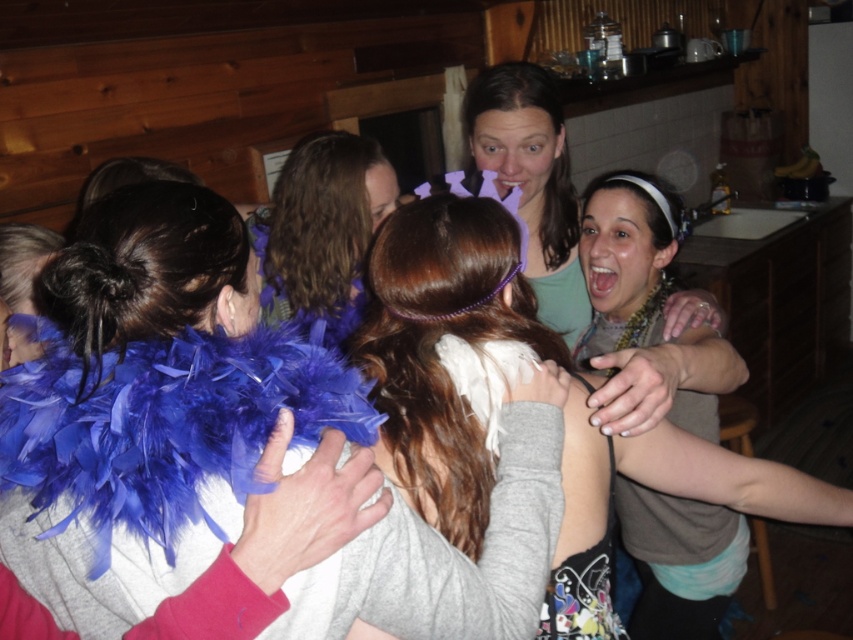
Is matte black tank top at center above matte purple headband at upper center?

Actually, matte black tank top at center is below matte purple headband at upper center.

Identify the location of matte black tank top at center. (643, 292).

Between point (706, 374) and point (630, 381), which one is positioned in front?

Point (630, 381)

Locate an element on the screen. matte black tank top at center is located at coordinates (643, 292).

Is white feather boa at center shorter than matte black tank top at center?

Yes, white feather boa at center is shorter than matte black tank top at center.

Locate an element on the screen. white feather boa at center is located at coordinates (440, 348).

Locate an element on the screen. The height and width of the screenshot is (640, 853). white feather boa at center is located at coordinates (440, 348).

Does blue feather boa at center appear on the right side of matte black tank top at center?

Incorrect, blue feather boa at center is not on the right side of matte black tank top at center.

Can you confirm if blue feather boa at center is bigger than matte black tank top at center?

Actually, blue feather boa at center might be smaller than matte black tank top at center.

Between point (498, 506) and point (715, 531), which one is positioned behind?

Positioned behind is point (715, 531).

Where is `blue feather boa at center`? blue feather boa at center is located at coordinates (155, 412).